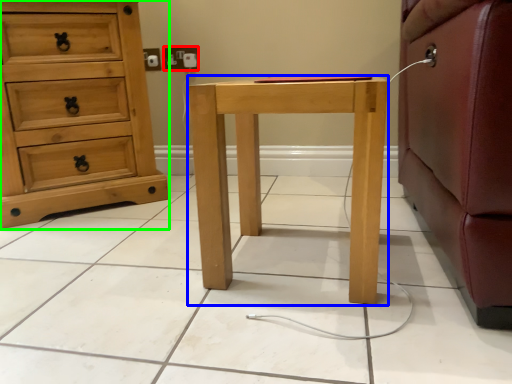
Question: Estimate the real-world distances between objects in this image. Which object is closer to electric outlet (highlighted by a red box), nightstand (highlighted by a blue box) or chest of drawers (highlighted by a green box)?

Choices:
 (A) nightstand
 (B) chest of drawers

Answer: (B)